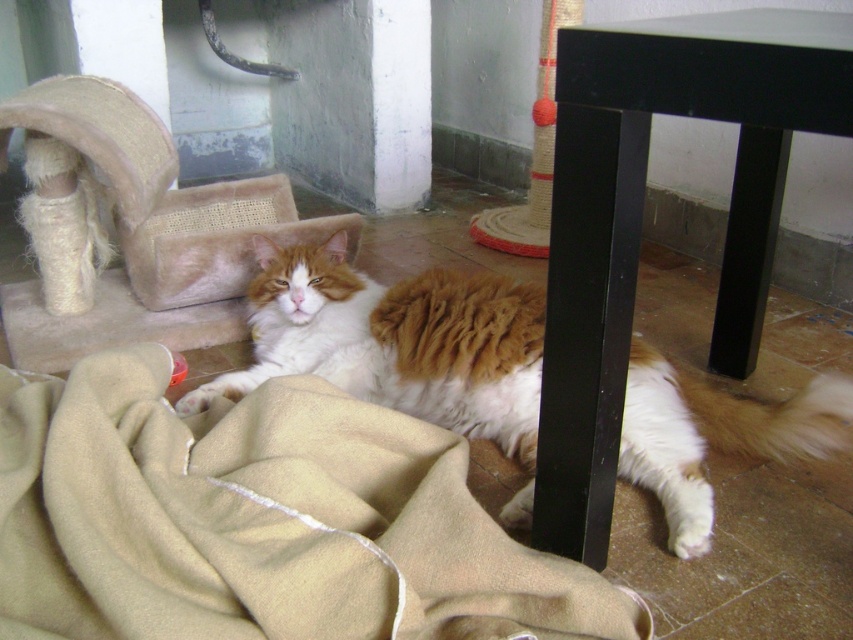
You are standing in the room and want to place a small toy mouse exactly where the beige woolen blanket at lower left is located. What coordinates should you use to place the toy mouse?

The beige woolen blanket at lower left is located at coordinates (x=259, y=522), so you should place the toy mouse at those coordinates.